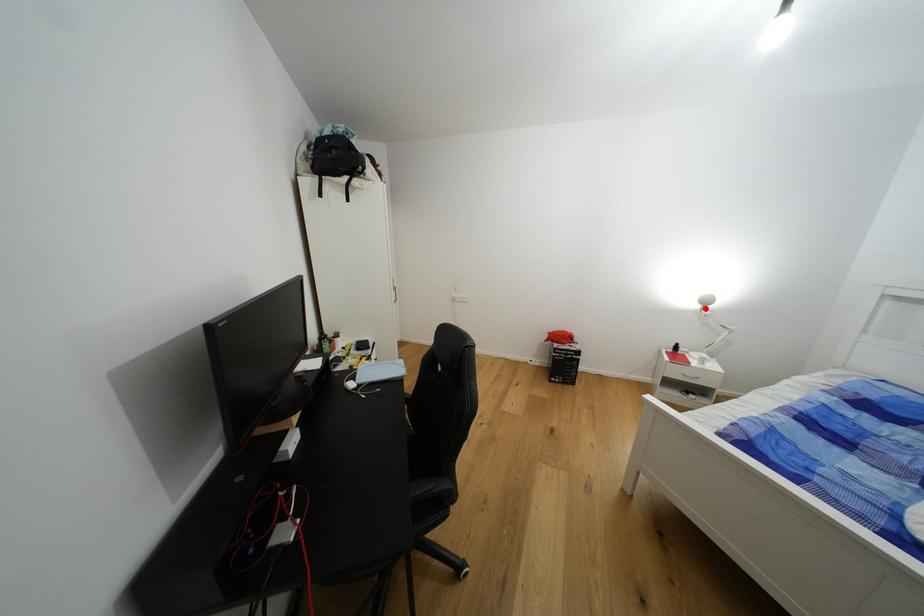
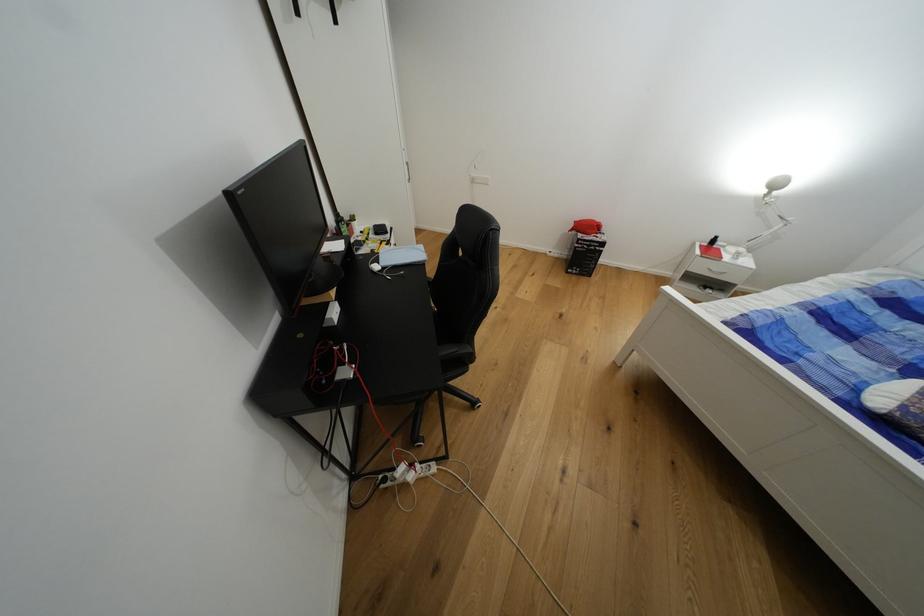
Question: I am providing you with two images of the same scene from different viewpoints. A red point is shown in image1. For the corresponding object point in image2, is it positioned nearer or farther from the camera?

Choices:
 (A) Nearer
 (B) Farther

Answer: (B)